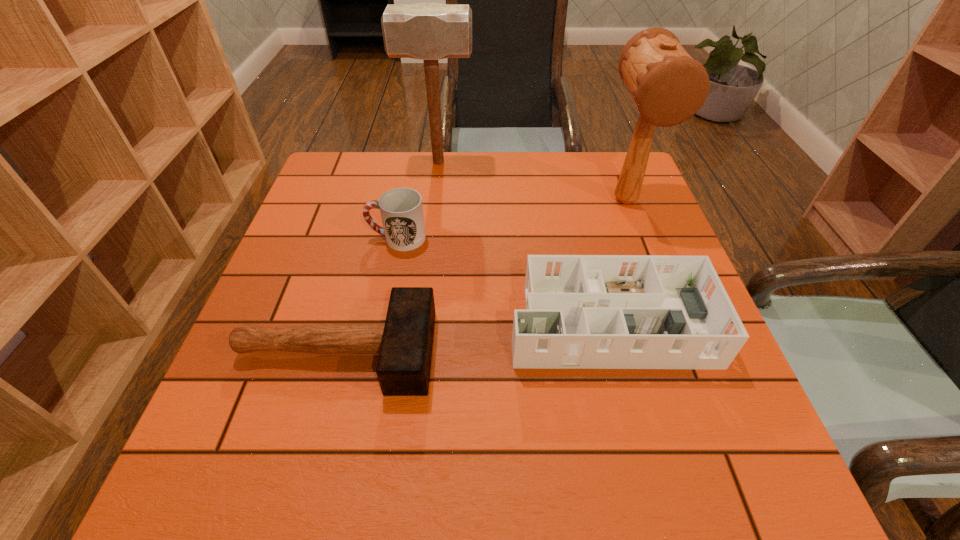
I want to click on mallet that stands as the closest to the farthest object, so click(668, 86).

Locate an element on the screen. Image resolution: width=960 pixels, height=540 pixels. vacant space that satisfies the following two spatial constraints: 1. on the striking face of the farthest object; 2. on the left side of the dollhouse is located at coordinates (420, 315).

Find the location of `free location that satisfies the following two spatial constraints: 1. on the strike surface of the second nearest mallet; 2. on the hammer head face of the nearest mallet`. free location that satisfies the following two spatial constraints: 1. on the strike surface of the second nearest mallet; 2. on the hammer head face of the nearest mallet is located at coordinates (684, 352).

Find the location of a particular element. This screenshot has height=540, width=960. free location that satisfies the following two spatial constraints: 1. on the back side of the dollhouse; 2. on the striking face of the farthest mallet is located at coordinates (567, 163).